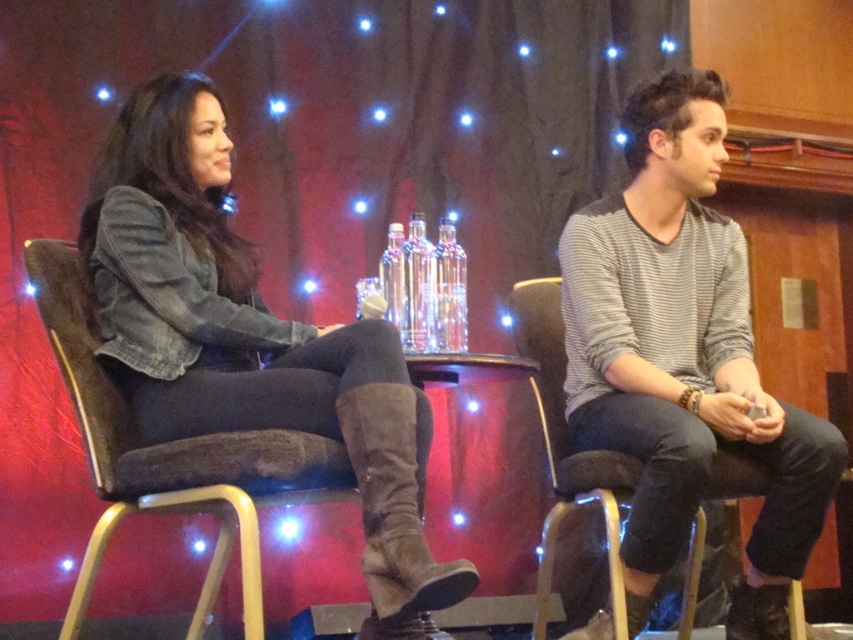
Between denim jacket at left and suede boot at lower center, which one is positioned lower?

Positioned lower is suede boot at lower center.

Can you confirm if denim jacket at left is positioned above suede boot at lower center?

Yes.

The image size is (853, 640). What are the coordinates of `denim jacket at left` in the screenshot? It's located at (248, 340).

Can you confirm if denim jacket at left is positioned above brown fabric chair at left?

Yes, denim jacket at left is above brown fabric chair at left.

Can you confirm if denim jacket at left is taller than brown fabric chair at left?

Yes, denim jacket at left is taller than brown fabric chair at left.

Is point (141, 186) positioned in front of point (241, 470)?

No, (141, 186) is further to viewer.

What are the coordinates of `denim jacket at left` in the screenshot? It's located at (248, 340).

Does brown fabric chair at left appear on the left side of suede boot at lower center?

Yes, brown fabric chair at left is to the left of suede boot at lower center.

Does brown fabric chair at left have a smaller size compared to suede boot at lower center?

No, brown fabric chair at left is not smaller than suede boot at lower center.

Is point (244, 566) closer to viewer compared to point (387, 497)?

That is True.

Locate an element on the screen. Image resolution: width=853 pixels, height=640 pixels. brown fabric chair at left is located at coordinates (173, 458).